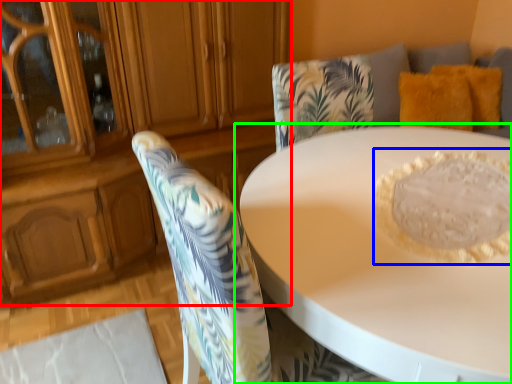
Question: Which object is positioned farthest from dresser (highlighted by a red box)? Select from food (highlighted by a blue box) and table (highlighted by a green box).

Choices:
 (A) food
 (B) table

Answer: (A)